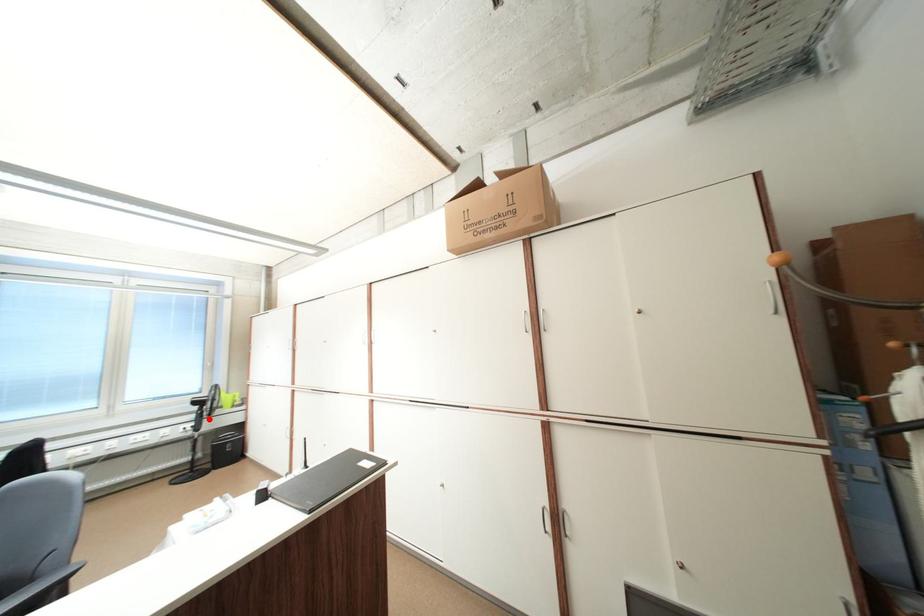
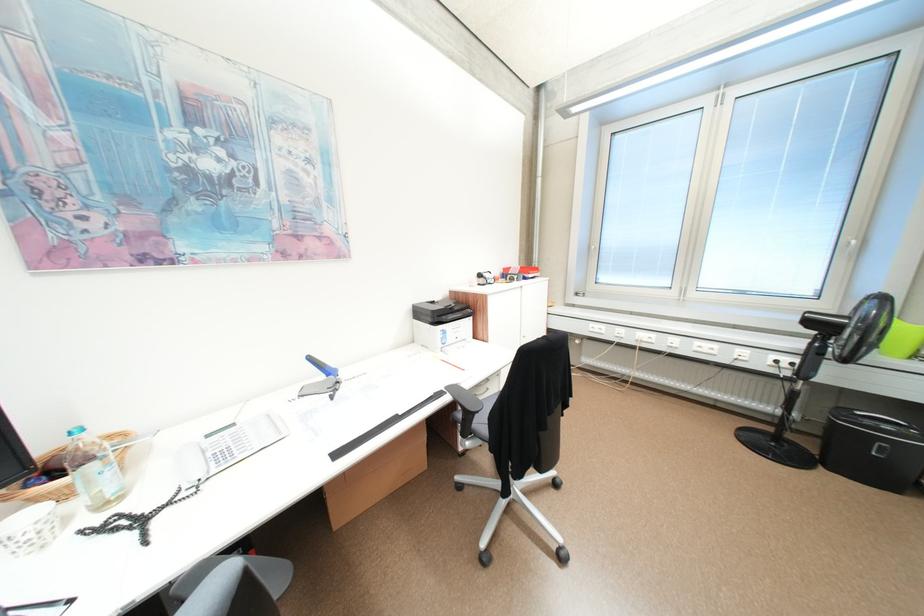
Locate, in the second image, the point that corresponds to the highlighted location in the first image.

(822, 357)